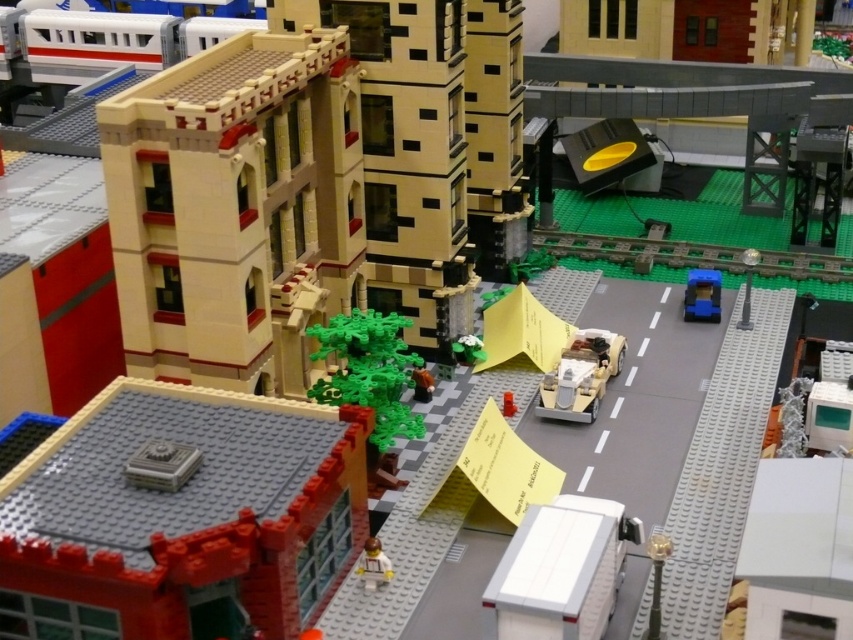
How distant is smooth red brick building at lower left from green plastic tree at center?

smooth red brick building at lower left and green plastic tree at center are 4.26 meters apart.

Is smooth red brick building at lower left behind green plastic tree at center?

That is False.

Between point (231, 602) and point (340, 374), which one is positioned in front?

Positioned in front is point (231, 602).

Where is `smooth red brick building at lower left`? The height and width of the screenshot is (640, 853). smooth red brick building at lower left is located at coordinates (183, 515).

Can you confirm if smooth red brick building at lower left is taller than brown matte teddy bear at center?

Yes.

Does smooth red brick building at lower left have a lesser height compared to brown matte teddy bear at center?

In fact, smooth red brick building at lower left may be taller than brown matte teddy bear at center.

Where is `smooth red brick building at lower left`? smooth red brick building at lower left is located at coordinates (183, 515).

What are the coordinates of `smooth red brick building at lower left` in the screenshot? It's located at (183, 515).

Does green plastic tree at center appear on the left side of blue plastic car at right?

Yes, green plastic tree at center is to the left of blue plastic car at right.

Which of these two, green plastic tree at center or blue plastic car at right, stands shorter?

Standing shorter between the two is blue plastic car at right.

Based on the photo, who is more distant from viewer, (421, 426) or (692, 282)?

The point (692, 282) is behind.

Where is `green plastic tree at center`? green plastic tree at center is located at coordinates (369, 371).